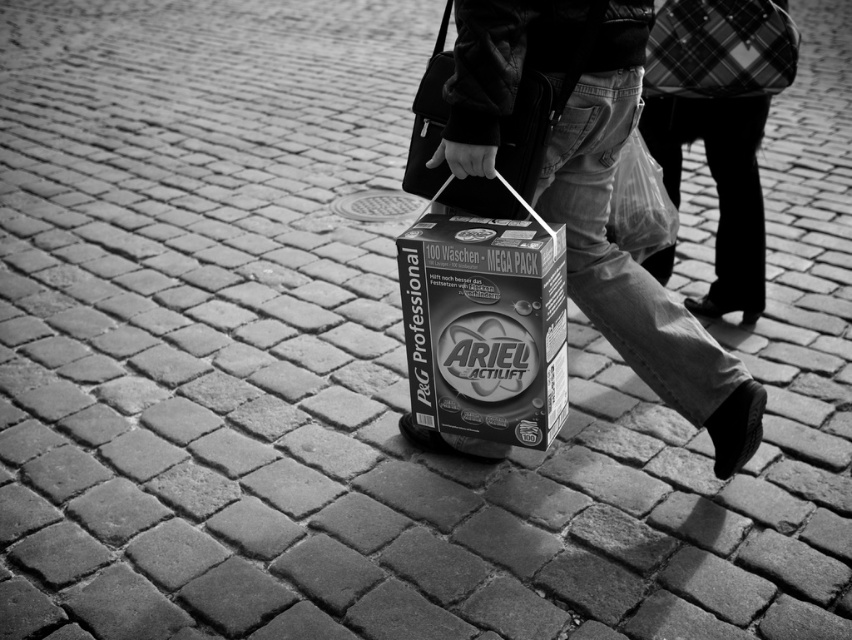
Question: Can you confirm if matte cardboard box at center is positioned above plaid fabric bag at upper right?

Choices:
 (A) no
 (B) yes

Answer: (A)

Question: Which object is the farthest from the plaid fabric bag at center?

Choices:
 (A) leather handbag at center
 (B) matte black cardboard box at center

Answer: (B)

Question: Can you confirm if matte black cardboard box at center is smaller than transparent plastic bag at center?

Choices:
 (A) no
 (B) yes

Answer: (A)

Question: Which point is farther from the camera taking this photo?

Choices:
 (A) (672, 90)
 (B) (427, 140)
 (C) (707, 307)

Answer: (C)

Question: Is matte black cardboard box at center thinner than leather handbag at center?

Choices:
 (A) yes
 (B) no

Answer: (B)

Question: Based on their relative distances, which object is farther from the matte cardboard box at center?

Choices:
 (A) transparent plastic bag at center
 (B) matte black cardboard box at center
 (C) plaid fabric bag at upper right

Answer: (C)